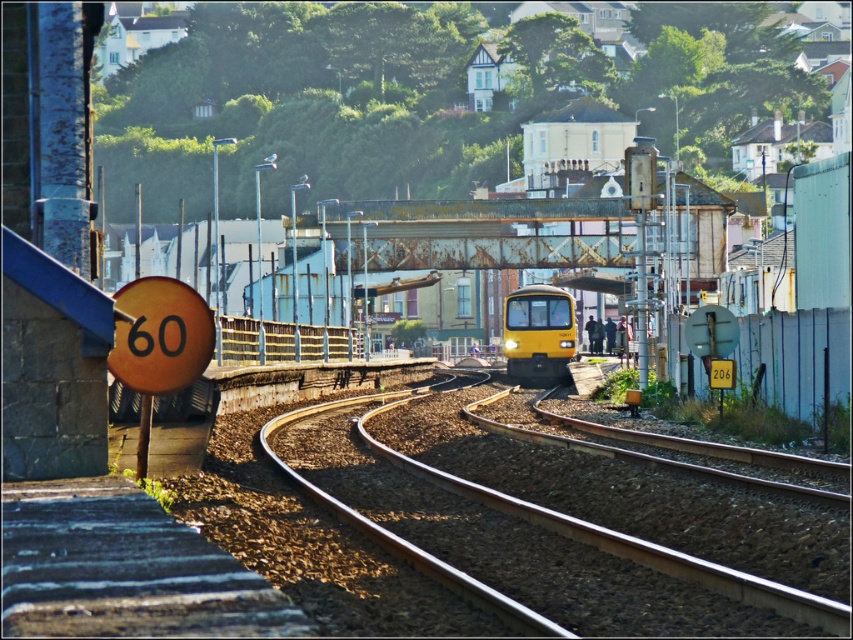
You are a maintenance worker checking the railway tracks. You notice the metallic tracks at center and the yellow matte train at center. Which object is lower in height?

The metallic tracks at center are lower in height compared to the yellow matte train at center as stated in the description.

You are a pedestrian waiting at the station platform. You see the metallic tracks at center and the yellow matte train at center. Which object is closer to the left edge of the platform?

The metallic tracks at center are closer to the left edge of the platform because they are positioned to the left of the yellow matte train at center.

You are standing on the platform and want to locate the metallic tracks at center. According to the scene description, where exactly would you find them?

A: You can find the metallic tracks at center at point [570,536].